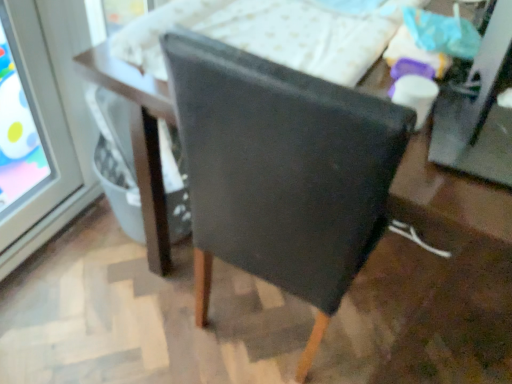
This screenshot has height=384, width=512. Identify the location of matte black table at center. (139, 140).

What is the approximate width of white textured mattress at upper center?

white textured mattress at upper center is 30.33 inches wide.

Find the location of a particular element. white textured mattress at upper center is located at coordinates (271, 34).

In order to click on matte black chair at center in this screenshot , I will do `click(281, 172)`.

Is matte black table at center looking in the opposite direction of white textured mattress at upper center?

A: No, white textured mattress at upper center is not at the back of matte black table at center.

Measure the distance from matte black table at center to white textured mattress at upper center.

matte black table at center is 12.53 inches away from white textured mattress at upper center.

Looking at this image, from a real-world perspective, who is located higher, matte black table at center or white textured mattress at upper center?

From a 3D spatial view, white textured mattress at upper center is above.

Who is taller, matte black table at center or white textured mattress at upper center?

With more height is matte black table at center.

Would you say matte black chair at center is outside white textured mattress at upper center?

Yes, matte black chair at center is outside of white textured mattress at upper center.

Considering the relative positions of matte black chair at center and white textured mattress at upper center in the image provided, is matte black chair at center in front of white textured mattress at upper center?

Yes.

Which is farther, (x=397, y=126) or (x=209, y=22)?

Positioned behind is point (x=209, y=22).

From the image's perspective, between matte black chair at center and white textured mattress at upper center, which one is located above?

white textured mattress at upper center appears higher in the image.

Would you say matte black chair at center is part of white textured mattress at upper center's contents?

No, white textured mattress at upper center does not contain matte black chair at center.

How different are the orientations of white textured mattress at upper center and matte black chair at center in degrees?

0.954 degrees.

In the scene shown: From the image's perspective, does white textured mattress at upper center appear higher than matte black chair at center?

Correct, white textured mattress at upper center appears higher than matte black chair at center in the image.

Is matte black table at center wider or thinner than matte black chair at center?

matte black table at center is thinner than matte black chair at center.

Visually, is matte black table at center positioned to the left or to the right of matte black chair at center?

In the image, matte black table at center appears on the left side of matte black chair at center.

From the image's perspective, is matte black table at center under matte black chair at center?

Actually, matte black table at center appears above matte black chair at center in the image.

Is matte black table at center in contact with matte black chair at center?

No.

The width and height of the screenshot is (512, 384). I want to click on table below the white textured mattress at upper center (from the image's perspective), so [139, 140].

Between point (258, 20) and point (157, 98), which one is positioned in front?

Point (157, 98)

Which is more to the left, white textured mattress at upper center or matte black table at center?

Positioned to the left is matte black table at center.

From a real-world perspective, is white textured mattress at upper center above or below matte black table at center?

In terms of real-world spatial position, white textured mattress at upper center is above matte black table at center.

Is matte black chair at center looking in the opposite direction of matte black table at center?

No, matte black chair at center's orientation is not away from matte black table at center.

Can you confirm if matte black chair at center is thinner than matte black table at center?

In fact, matte black chair at center might be wider than matte black table at center.

Can you see matte black chair at center touching matte black table at center?

No, matte black chair at center is not in contact with matte black table at center.

Which of these two, matte black chair at center or matte black table at center, is smaller?

Smaller between the two is matte black table at center.

Locate an element on the screen. bed in front of the matte black table at center is located at coordinates (271, 34).

You are a GUI agent. You are given a task and a screenshot of the screen. Output one action in this format:
    pyautogui.click(x=<x>, y=<y>)
    Task: Click on the chair below the white textured mattress at upper center (from a real-world perspective)
    This screenshot has width=512, height=384.
    Given the screenshot: What is the action you would take?
    pyautogui.click(x=281, y=172)

From the image, which object appears to be nearer to matte black table at center, matte black chair at center or white textured mattress at upper center?

Among the two, matte black chair at center is located nearer to matte black table at center.

Which object lies further to the anchor point matte black chair at center, white textured mattress at upper center or matte black table at center?

The object further to matte black chair at center is white textured mattress at upper center.

Which object lies nearer to the anchor point matte black chair at center, matte black table at center or white textured mattress at upper center?

matte black table at center is positioned closer to the anchor matte black chair at center.

Estimate the real-world distances between objects in this image. Which object is further from matte black table at center, white textured mattress at upper center or matte black chair at center?

white textured mattress at upper center.

In the scene shown: Estimate the real-world distances between objects in this image. Which object is closer to white textured mattress at upper center, matte black table at center or matte black chair at center?

Based on the image, matte black table at center appears to be nearer to white textured mattress at upper center.

Looking at the image, which one is located closer to white textured mattress at upper center, matte black chair at center or matte black table at center?

matte black table at center lies closer to white textured mattress at upper center than the other object.

Where is `bed located between matte black table at center and matte black chair at center in the left-right direction`? This screenshot has height=384, width=512. bed located between matte black table at center and matte black chair at center in the left-right direction is located at coordinates (271, 34).